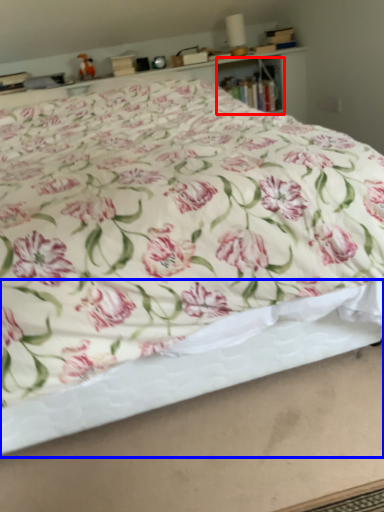
Question: Which object is closer to the camera taking this photo, cabinet (highlighted by a red box) or bed frame (highlighted by a blue box)?

Choices:
 (A) cabinet
 (B) bed frame

Answer: (B)